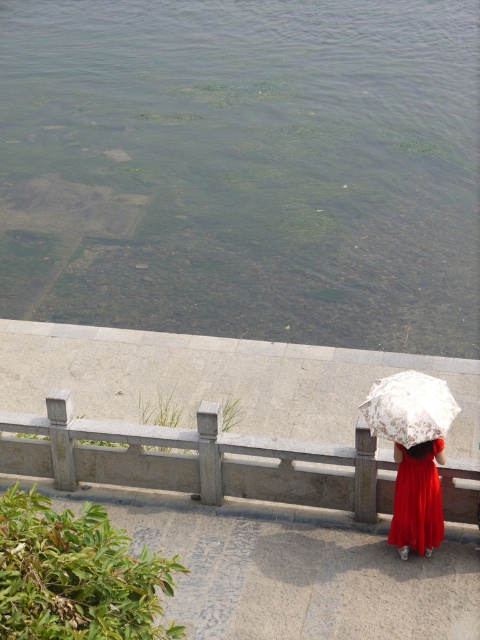
Question: Can you confirm if gray stone railing at lower center is wider than matte red dress at lower right?

Choices:
 (A) no
 (B) yes

Answer: (B)

Question: Does gray stone railing at lower center come in front of matte red dress at lower right?

Choices:
 (A) no
 (B) yes

Answer: (A)

Question: Estimate the real-world distances between objects in this image. Which object is closer to the green algae at upper center?

Choices:
 (A) gray stone railing at lower center
 (B) white lace umbrella at lower right
 (C) matte red dress at lower right

Answer: (A)

Question: Does gray stone railing at lower center appear over matte red dress at lower right?

Choices:
 (A) no
 (B) yes

Answer: (B)

Question: Which object is the closest to the white lace umbrella at lower right?

Choices:
 (A) green algae at upper center
 (B) matte red dress at lower right

Answer: (B)

Question: Among these points, which one is farthest from the camera?

Choices:
 (A) (330, 467)
 (B) (394, 291)
 (C) (428, 440)

Answer: (B)